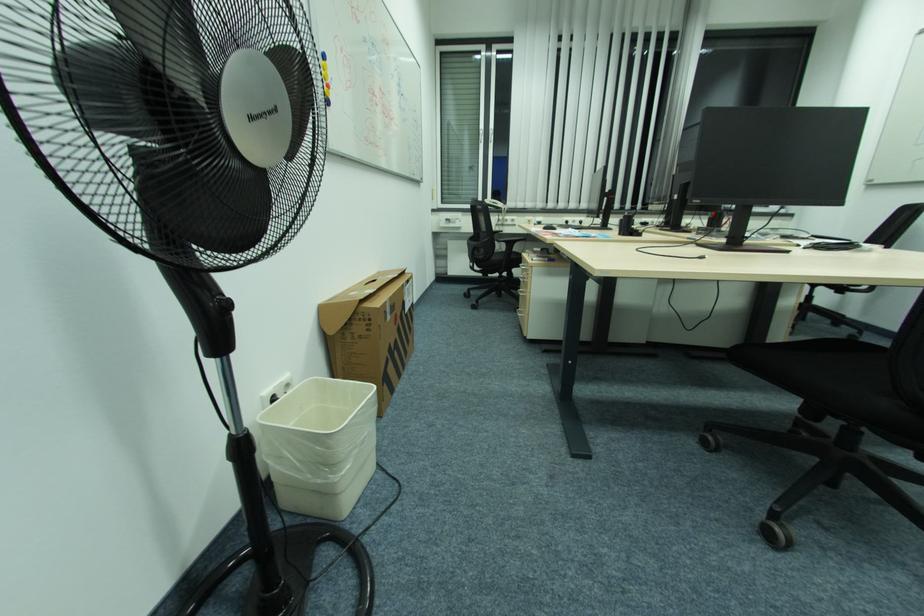
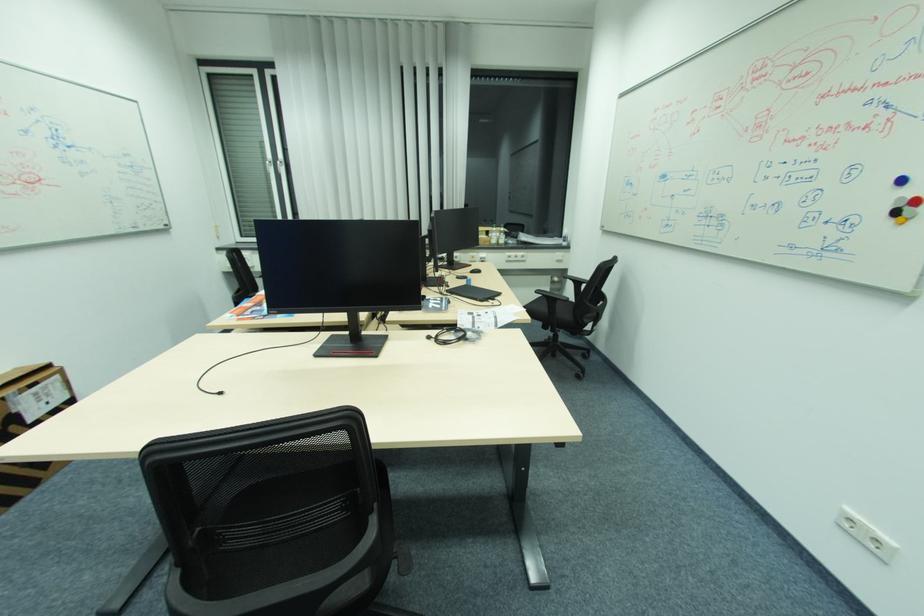
Where in the second image is the point corresponding to (x=703, y=257) from the first image?

(223, 392)